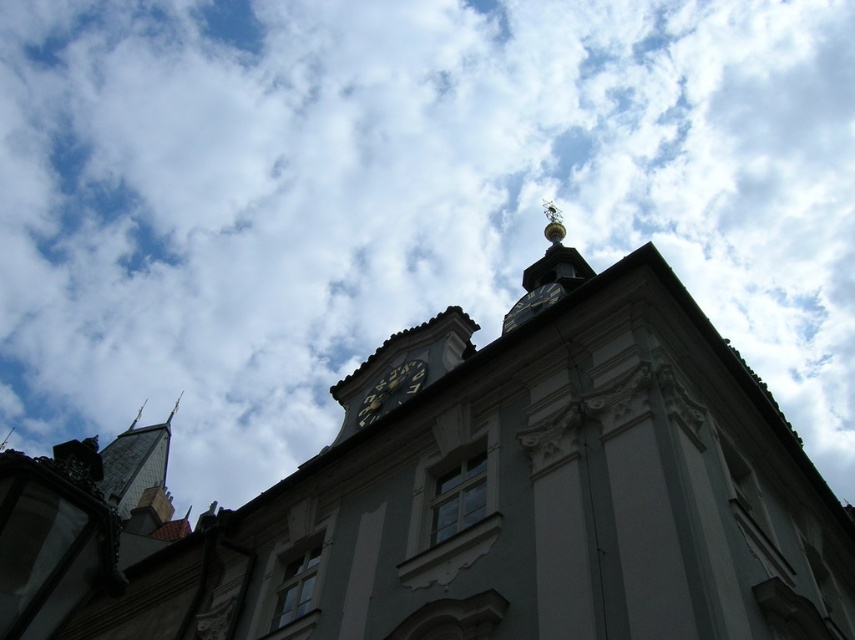
From the picture: You are standing in front of the historic building and want to take a photo. You notice two points marked on the clock tower. Which point, point (376, 390) or point (526, 296), is closer to your current position?

Point (376, 390) is closer to the camera than point (526, 296), so it is closer to your current position.

You are standing in front of the historic building and want to take a photo that includes both the gray stone tower at left and the black metal clock at center. Based on their positions, which object should you frame first in your camera viewfinder to ensure both are captured?

The gray stone tower at left is to the left of the black metal clock at center, so you should frame the gray stone tower at left first to ensure both are captured in the photo.